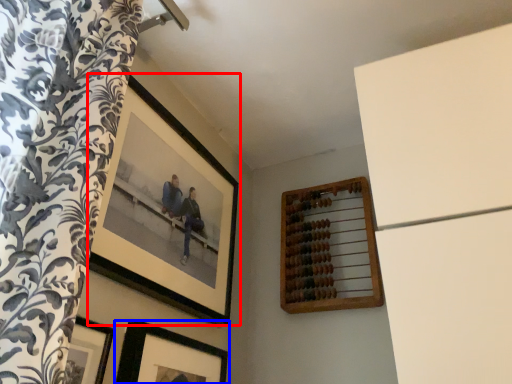
Question: Which point is further to the camera, picture frame (highlighted by a red box) or picture frame (highlighted by a blue box)?

Choices:
 (A) picture frame
 (B) picture frame

Answer: (A)